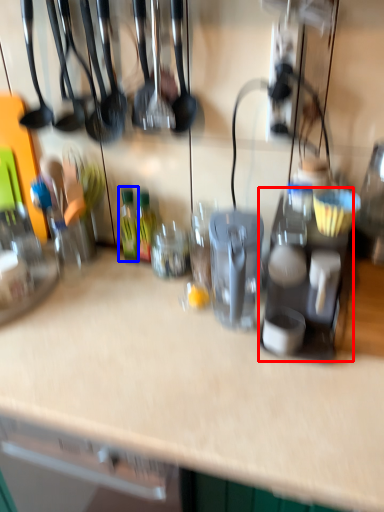
Question: Among these objects, which one is nearest to the camera, appliance (highlighted by a red box) or bottle (highlighted by a blue box)?

Choices:
 (A) appliance
 (B) bottle

Answer: (A)